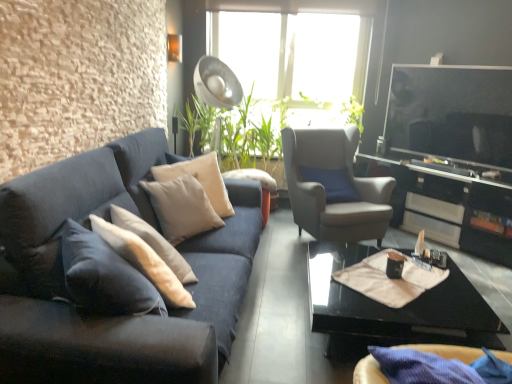
Question: From the image's perspective, is black glossy entertainment center at right beneath velvet dark blue couch at left?

Choices:
 (A) no
 (B) yes

Answer: (A)

Question: From a real-world perspective, is black glossy entertainment center at right below velvet dark blue couch at left?

Choices:
 (A) yes
 (B) no

Answer: (A)

Question: From the image's perspective, is black glossy entertainment center at right located above velvet dark blue couch at left?

Choices:
 (A) no
 (B) yes

Answer: (B)

Question: Is black glossy entertainment center at right in front of velvet dark blue couch at left?

Choices:
 (A) yes
 (B) no

Answer: (B)

Question: Is black glossy entertainment center at right oriented away from velvet dark blue couch at left?

Choices:
 (A) no
 (B) yes

Answer: (A)

Question: Considering the relative sizes of black glossy entertainment center at right and velvet dark blue couch at left in the image provided, is black glossy entertainment center at right smaller than velvet dark blue couch at left?

Choices:
 (A) yes
 (B) no

Answer: (B)

Question: From the image's perspective, would you say beige fabric at center is shown under velvet dark blue couch at left?

Choices:
 (A) yes
 (B) no

Answer: (A)

Question: From the image's perspective, is beige fabric at center located above velvet dark blue couch at left?

Choices:
 (A) no
 (B) yes

Answer: (A)

Question: Does beige fabric at center have a smaller size compared to velvet dark blue couch at left?

Choices:
 (A) yes
 (B) no

Answer: (A)

Question: From a real-world perspective, is beige fabric at center over velvet dark blue couch at left?

Choices:
 (A) no
 (B) yes

Answer: (A)

Question: Is beige fabric at center further to camera compared to velvet dark blue couch at left?

Choices:
 (A) no
 (B) yes

Answer: (B)

Question: Are beige fabric at center and velvet dark blue couch at left far apart?

Choices:
 (A) yes
 (B) no

Answer: (A)

Question: From the image's perspective, is creamy white fabric pillow at center, marked as the first pillow in a back-to-front arrangement, below velvet dark blue couch at left?

Choices:
 (A) no
 (B) yes

Answer: (A)